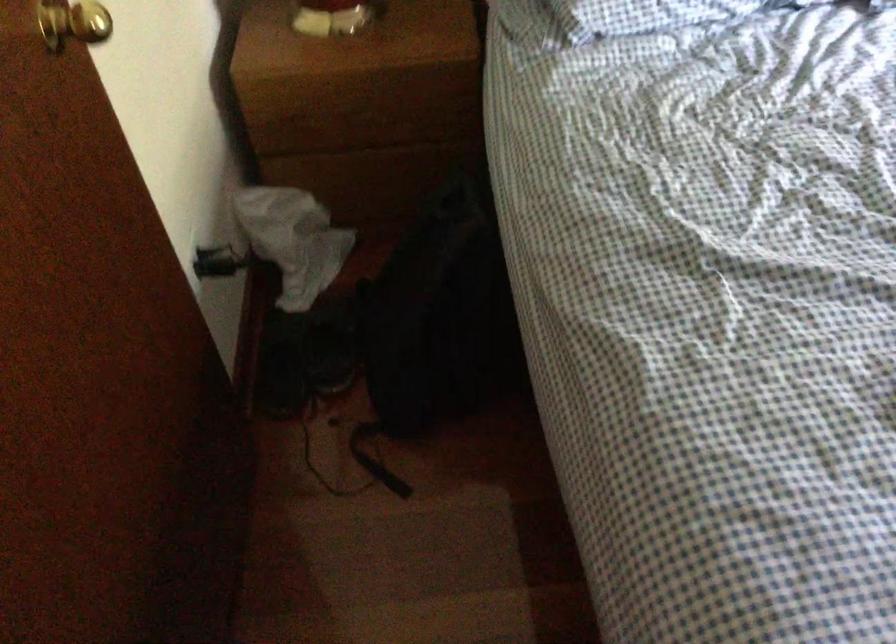
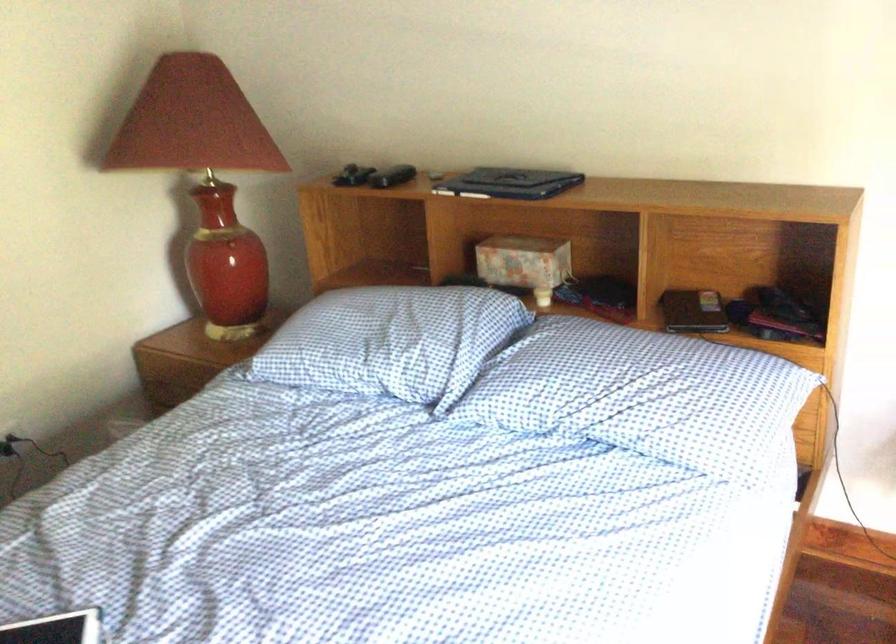
Question: I am providing you with two images of the same scene from different viewpoints. After the viewpoint changes to image2, which objects are now occluded?

Choices:
 (A) white covered book
 (B) closed laptop
 (C) black backpack
 (D) black game controller

Answer: (C)